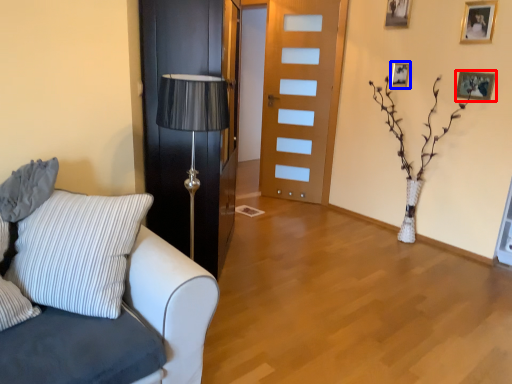
Question: Which object appears farthest to the camera in this image, picture frame (highlighted by a red box) or picture frame (highlighted by a blue box)?

Choices:
 (A) picture frame
 (B) picture frame

Answer: (B)